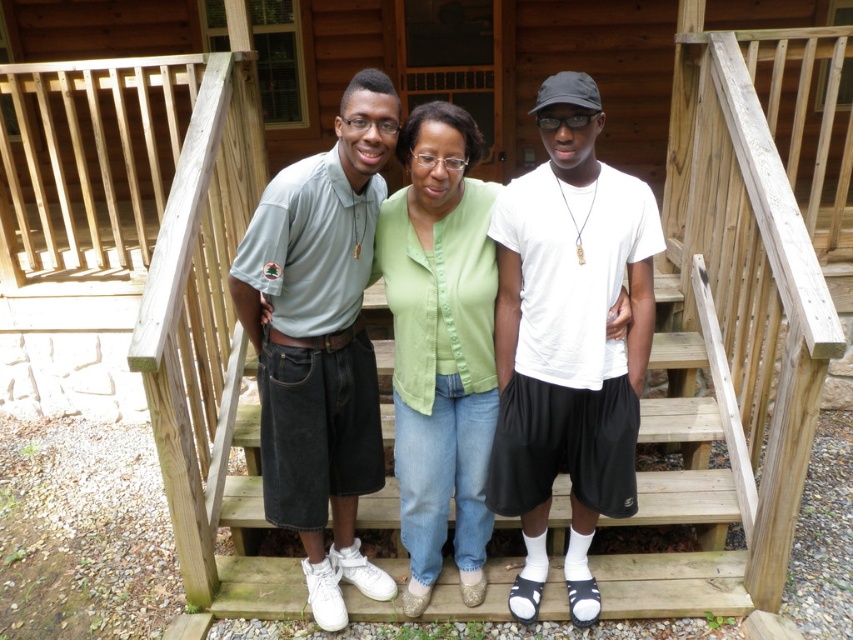
Who is positioned more to the left, white matte t-shirt at center or light gray polo shirt at center?

From the viewer's perspective, light gray polo shirt at center appears more on the left side.

Image resolution: width=853 pixels, height=640 pixels. Identify the location of white matte t-shirt at center. (567, 339).

At what (x,y) coordinates should I click in order to perform the action: click on white matte t-shirt at center. Please return your answer as a coordinate pair (x, y). Looking at the image, I should click on (567, 339).

Which is behind, point (299, 182) or point (469, 513)?

Point (469, 513)

Is light gray polo shirt at center to the right of green fabric shirt at center from the viewer's perspective?

Incorrect, light gray polo shirt at center is not on the right side of green fabric shirt at center.

Between point (280, 316) and point (401, 138), which one is positioned in front?

Point (401, 138) is more forward.

Where is `light gray polo shirt at center`? light gray polo shirt at center is located at coordinates (320, 342).

Is point (468, 410) farther from viewer compared to point (334, 454)?

No, (468, 410) is in front of (334, 454).

Can you confirm if matte green shirt at center is shorter than light gray polo shirt at center?

In fact, matte green shirt at center may be taller than light gray polo shirt at center.

This screenshot has width=853, height=640. I want to click on matte green shirt at center, so click(451, 317).

This screenshot has width=853, height=640. Find the location of `matte green shirt at center`. matte green shirt at center is located at coordinates (451, 317).